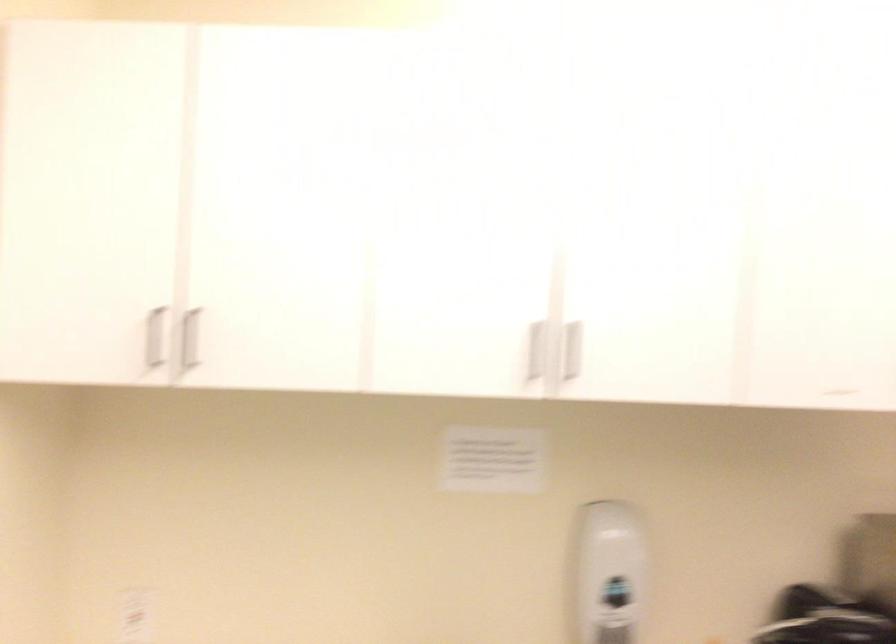
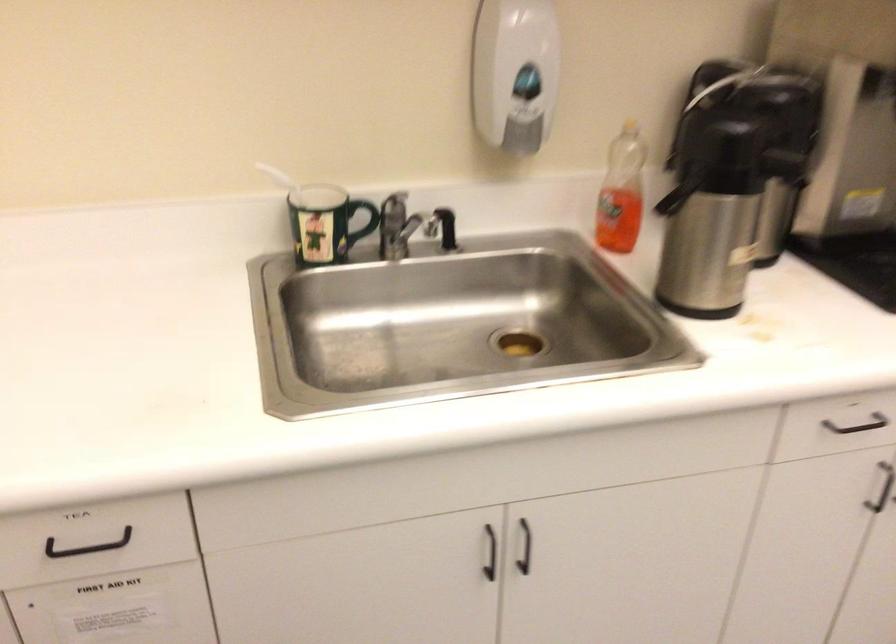
Question: The first image is from the beginning of the video and the second image is from the end. How did the camera likely rotate when shooting the video?

Choices:
 (A) Left
 (B) Right
 (C) Up
 (D) Down

Answer: (D)